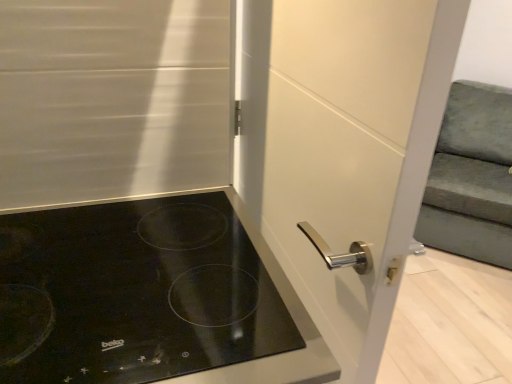
Question: Considering the relative positions of black glass cooktop at lower left and white glossy door handle at center in the image provided, is black glass cooktop at lower left to the left or to the right of white glossy door handle at center?

Choices:
 (A) right
 (B) left

Answer: (B)

Question: From the image's perspective, relative to white glossy door handle at center, is black glass cooktop at lower left above or below?

Choices:
 (A) above
 (B) below

Answer: (B)

Question: Estimate the real-world distances between objects in this image. Which object is farther from the white glossy door handle at center?

Choices:
 (A) black glass cooktop at lower left
 (B) velvet green armchair at right

Answer: (B)

Question: Which of these objects is positioned farthest from the velvet green armchair at right?

Choices:
 (A) white glossy door handle at center
 (B) black glass cooktop at lower left

Answer: (B)